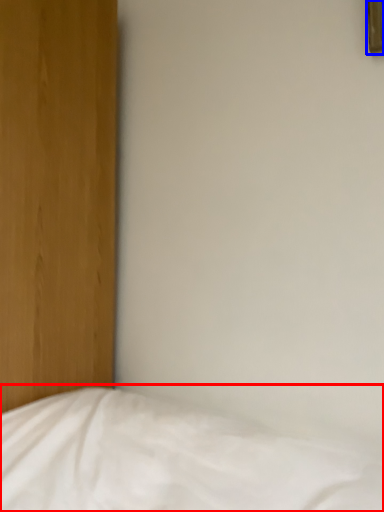
Question: Which object appears closest to the camera in this image, bed (highlighted by a red box) or picture frame (highlighted by a blue box)?

Choices:
 (A) bed
 (B) picture frame

Answer: (A)